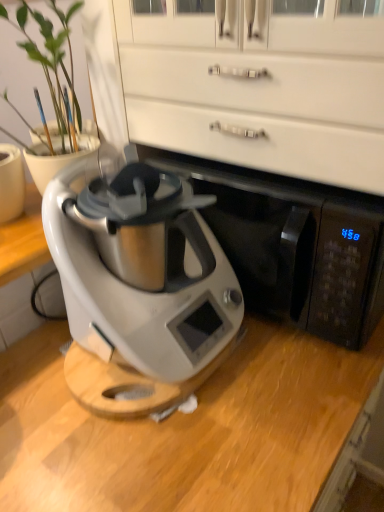
Question: From a real-world perspective, is white glossy dresser at upper center below satin silver appliance at center?

Choices:
 (A) yes
 (B) no

Answer: (B)

Question: Can you confirm if white glossy dresser at upper center is wider than satin silver appliance at center?

Choices:
 (A) no
 (B) yes

Answer: (A)

Question: Could you tell me if white glossy dresser at upper center is turned towards satin silver appliance at center?

Choices:
 (A) no
 (B) yes

Answer: (B)

Question: From a real-world perspective, does white glossy dresser at upper center stand above satin silver appliance at center?

Choices:
 (A) no
 (B) yes

Answer: (B)

Question: Is white glossy dresser at upper center located outside satin silver appliance at center?

Choices:
 (A) yes
 (B) no

Answer: (A)

Question: Is satin silver appliance at center wider or thinner than white glossy dresser at upper center?

Choices:
 (A) wide
 (B) thin

Answer: (A)

Question: Is satin silver appliance at center inside or outside of white glossy dresser at upper center?

Choices:
 (A) inside
 (B) outside

Answer: (B)

Question: Would you say satin silver appliance at center is to the left or to the right of white glossy dresser at upper center in the picture?

Choices:
 (A) right
 (B) left

Answer: (B)

Question: From the image's perspective, is satin silver appliance at center above or below white glossy dresser at upper center?

Choices:
 (A) above
 (B) below

Answer: (B)

Question: Does point (96, 132) appear closer or farther from the camera than point (324, 268)?

Choices:
 (A) farther
 (B) closer

Answer: (A)

Question: Considering the positions of matte white vase at left and satin silver appliance at center in the image, is matte white vase at left bigger or smaller than satin silver appliance at center?

Choices:
 (A) small
 (B) big

Answer: (A)

Question: Is matte white vase at left taller or shorter than satin silver appliance at center?

Choices:
 (A) tall
 (B) short

Answer: (A)

Question: Relative to satin silver appliance at center, is matte white vase at left in front or behind?

Choices:
 (A) front
 (B) behind

Answer: (A)

Question: From their relative heights in the image, would you say satin silver appliance at center is taller or shorter than white glossy dresser at upper center?

Choices:
 (A) short
 (B) tall

Answer: (A)

Question: From a real-world perspective, relative to white glossy dresser at upper center, is satin silver appliance at center vertically above or below?

Choices:
 (A) above
 (B) below

Answer: (B)